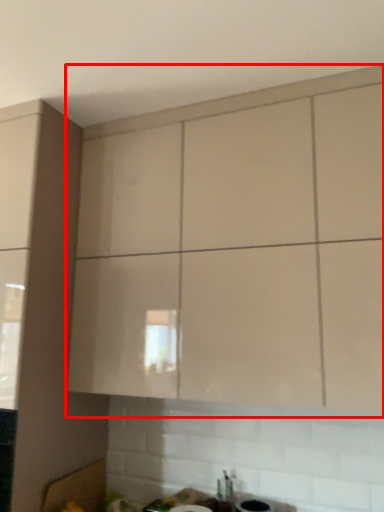
Question: From the image's perspective, what is the correct spatial relationship of cabinetry (annotated by the red box) in relation to sink?

Choices:
 (A) below
 (B) above

Answer: (B)